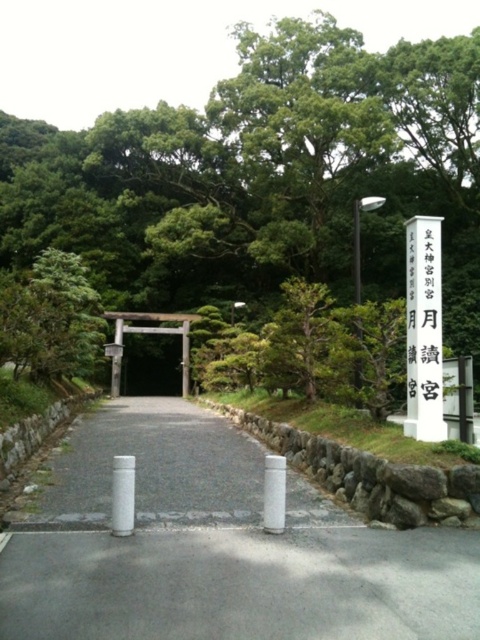
You are a visitor approaching the entrance of the shrine. You see the gray asphalt path at center and the wooden gate at center. Which object is positioned higher from the ground?

The gray asphalt path at center is located above the wooden gate at center, so the gray asphalt path at center is higher from the ground.

You are standing at the entrance of the Japanese shrine and want to place two decorative stones at the coordinates point (299, 490) and point (163, 330). Which coordinate will have the stone placed closer to you?

Point (299, 490) is closer to the viewer than point (163, 330), so the stone placed at point (299, 490) will be closer to you.

You are a visitor approaching the entrance of the shrine. You notice the wooden torii gate at center and the white smooth pillar at center. Which object is positioned higher from the ground?

The wooden torii gate at center is located above the white smooth pillar at center, so it is positioned higher from the ground.